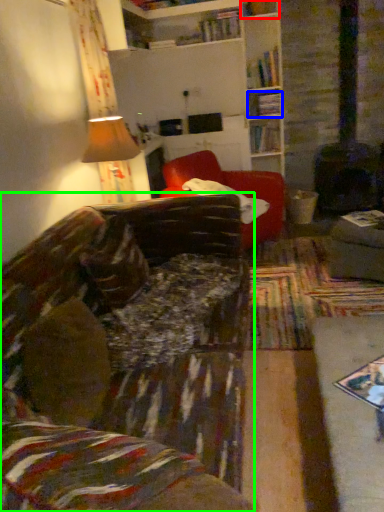
Question: Considering the real-world distances, which object is farthest from shelf (highlighted by a red box)? shelf (highlighted by a blue box) or studio couch (highlighted by a green box)?

Choices:
 (A) shelf
 (B) studio couch

Answer: (B)